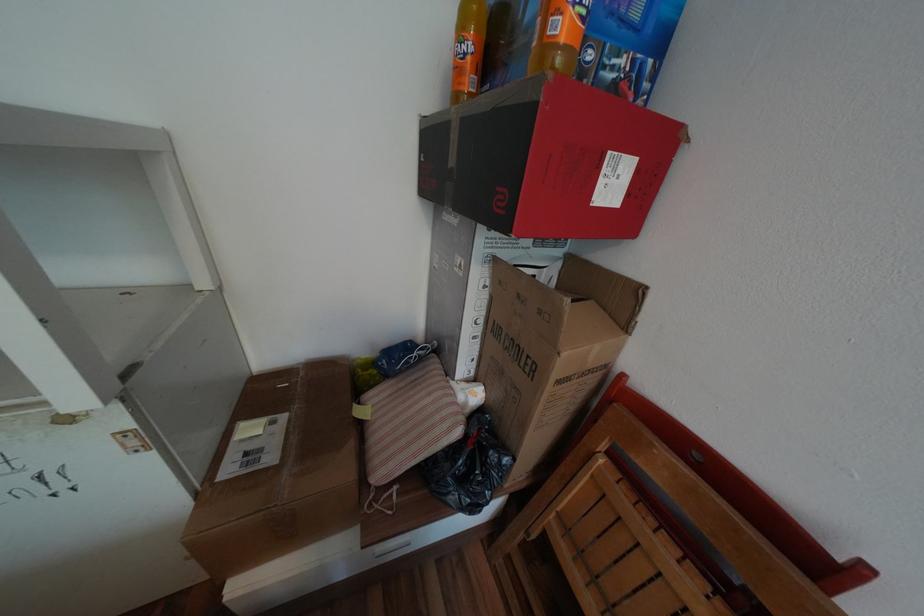
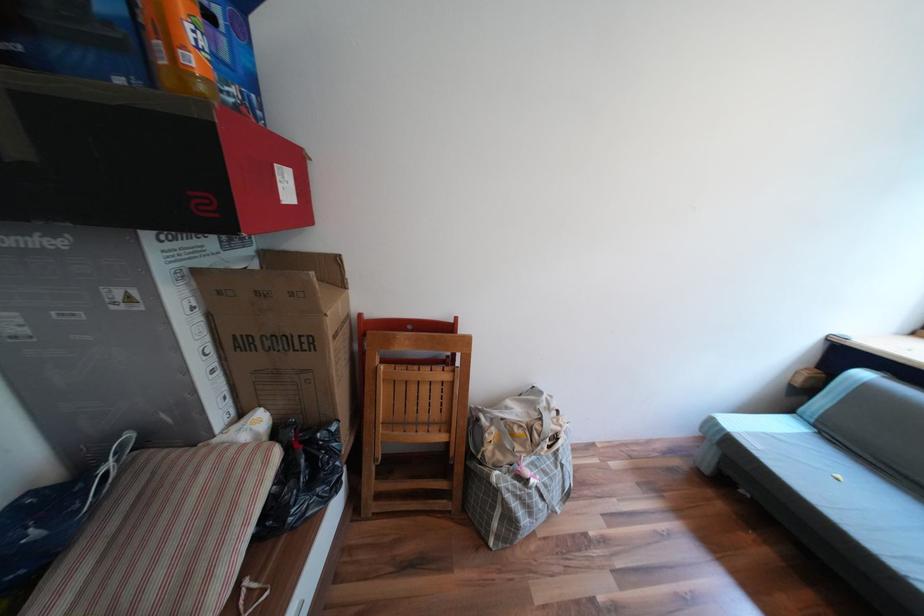
Locate, in the second image, the point that corresponds to [490,321] in the first image.

(219, 349)